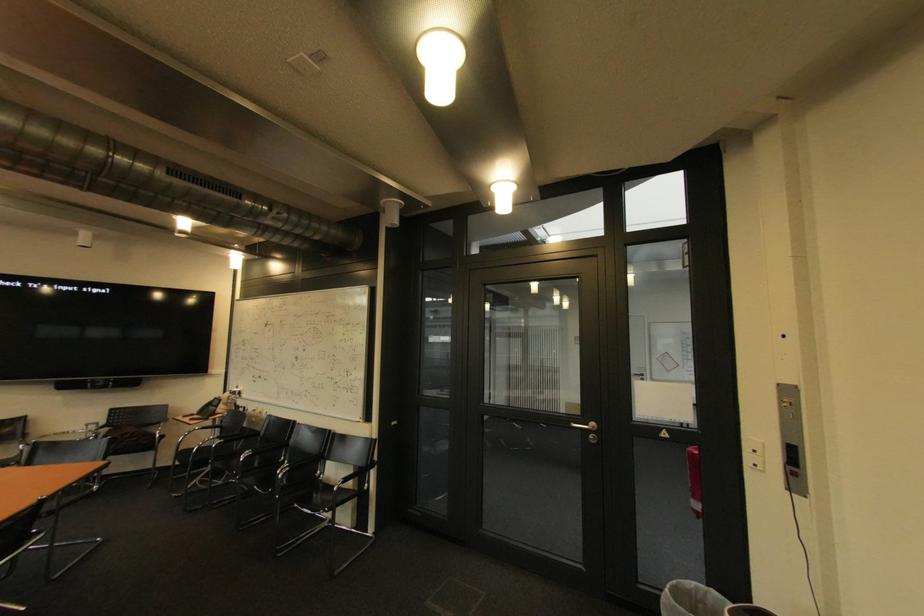
Where is `black phone handset`? black phone handset is located at coordinates (207, 407).